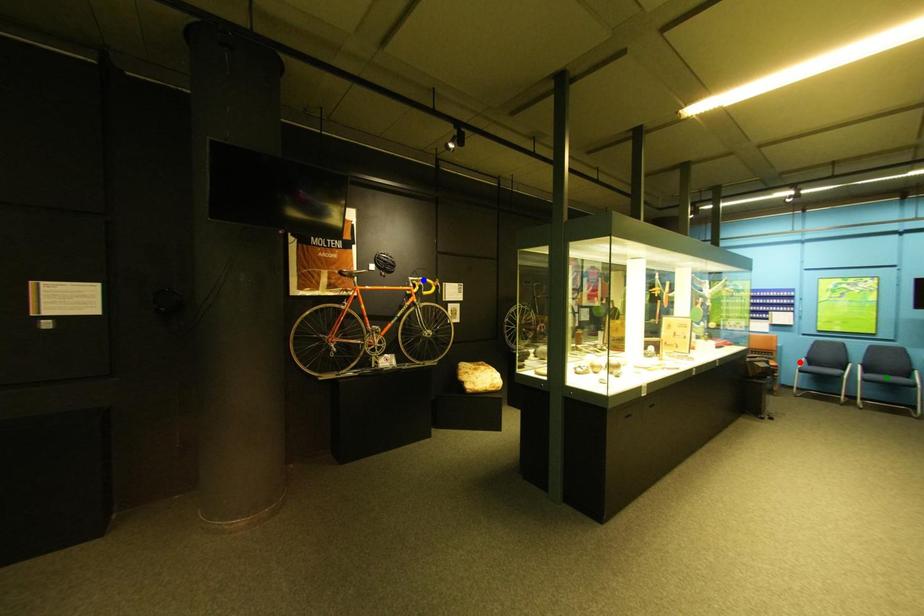
Order these from nearest to farthest:
A) red point
B) green point
C) blue point

1. green point
2. blue point
3. red point